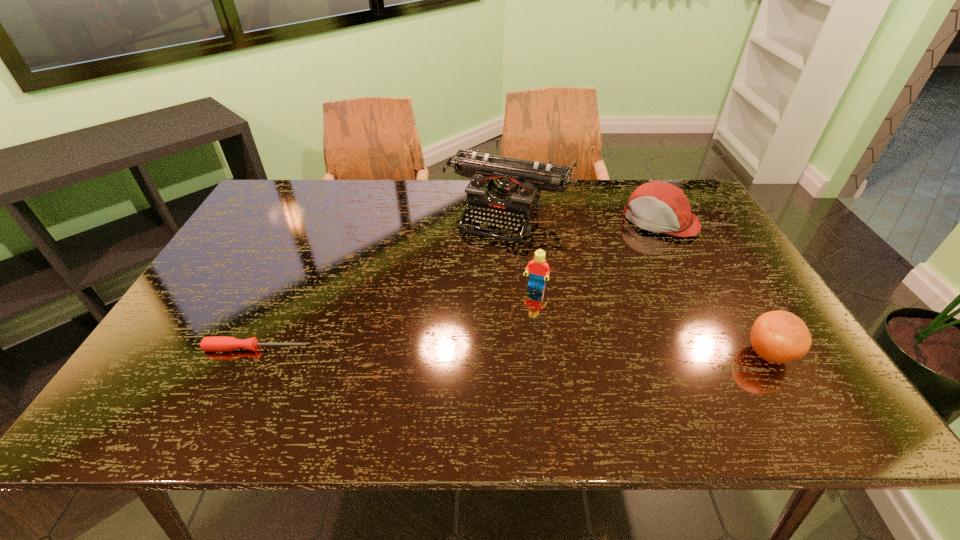
Identify the location of vacant space on the desktop that is between the leftmost object and the orange and is positioned on the keyboard of the typewriter. The height and width of the screenshot is (540, 960). (444, 350).

What are the coordinates of `vacant space on the desktop that is between the leftmost object and the orange and is positioned on the front-facing side of the cap` in the screenshot? It's located at (562, 352).

In order to click on free spot on the desktop that is between the screwdriver and the orange and is positioned on the face of the third farthest object in this screenshot , I will do `click(512, 351)`.